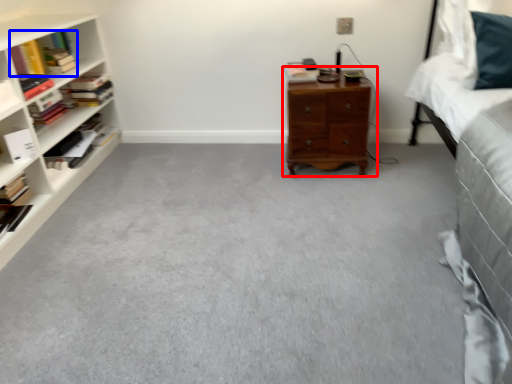
Question: Among these objects, which one is nearest to the camera, nightstand (highlighted by a red box) or book (highlighted by a blue box)?

Choices:
 (A) nightstand
 (B) book

Answer: (A)